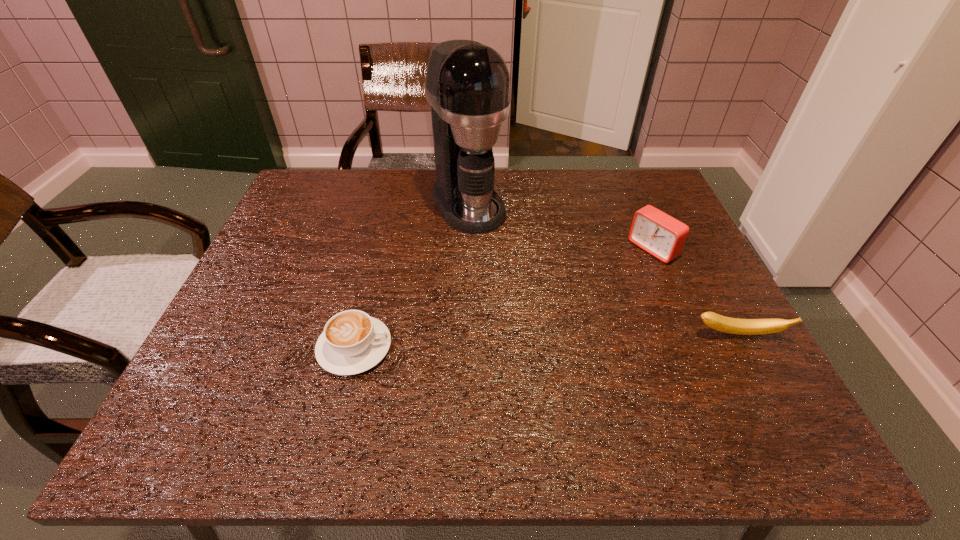
You are a GUI agent. You are given a task and a screenshot of the screen. Output one action in this format:
    pyautogui.click(x=<x>, y=<y>)
    Task: Click on the blank space located 0.050m on the front-facing side of the alarm clock
    This screenshot has height=540, width=960.
    Given the screenshot: What is the action you would take?
    pyautogui.click(x=626, y=267)

Identify the location of vacant space situated on the front-facing side of the alarm clock. (592, 289).

Locate an element on the screen. The width and height of the screenshot is (960, 540). vacant space located 0.230m on the front-facing side of the alarm clock is located at coordinates (575, 300).

You are a GUI agent. You are given a task and a screenshot of the screen. Output one action in this format:
    pyautogui.click(x=<x>, y=<y>)
    Task: Click on the object located at the far edge
    Image resolution: width=960 pixels, height=540 pixels.
    Given the screenshot: What is the action you would take?
    pyautogui.click(x=467, y=84)

I want to click on object that is at the near edge, so click(x=352, y=342).

Locate an element on the screen. banana located at the right edge is located at coordinates (715, 321).

The height and width of the screenshot is (540, 960). I want to click on alarm clock present at the right edge, so click(659, 234).

The height and width of the screenshot is (540, 960). Find the location of `free space at the far edge of the desktop`. free space at the far edge of the desktop is located at coordinates (512, 214).

The width and height of the screenshot is (960, 540). In the image, there is a desktop. What are the coordinates of `vacant region at the near edge` in the screenshot? It's located at (646, 364).

Image resolution: width=960 pixels, height=540 pixels. In the image, there is a desktop. Find the location of `vacant space at the left edge`. vacant space at the left edge is located at coordinates click(279, 295).